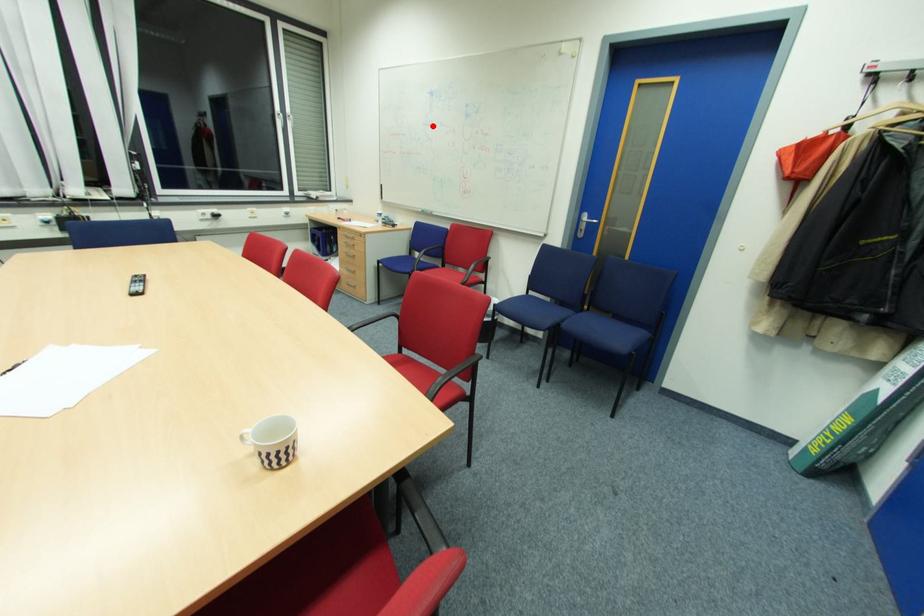
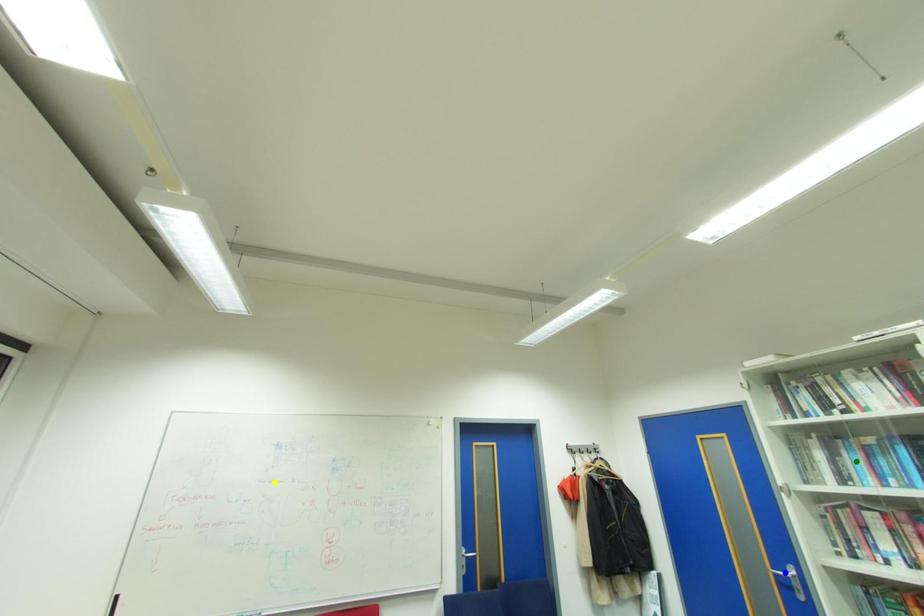
Question: I am providing you with two images of the same scene from different viewpoints. A red point is marked on the first image. You are given multiple points on the second image. In image 2, which mark is for the same physical point as the one in image 1?

Choices:
 (A) blue point
 (B) yellow point
 (C) green point

Answer: (B)